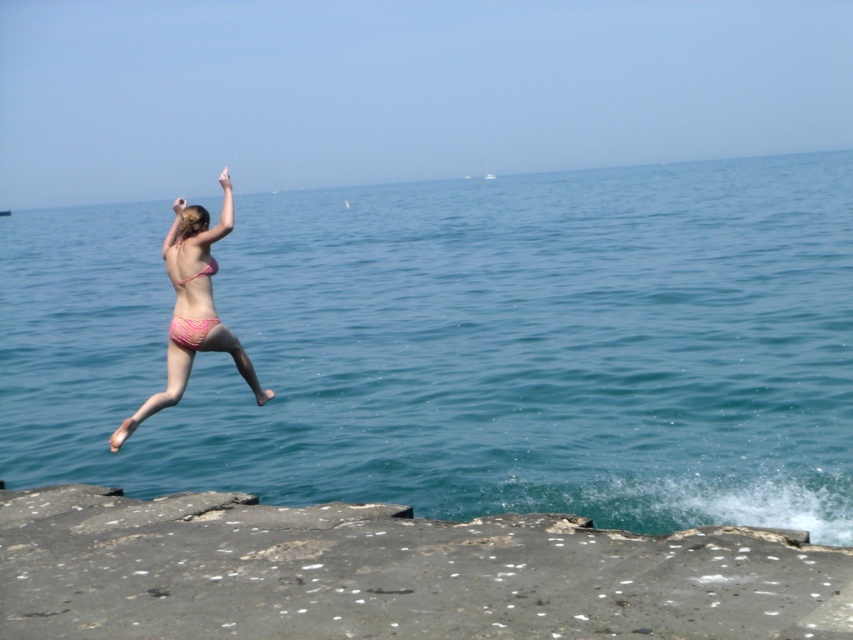
Question: Can you confirm if pink fabric bikini at left is positioned above pink matte bikini top at center?

Choices:
 (A) no
 (B) yes

Answer: (A)

Question: Which object appears farthest from the camera in this image?

Choices:
 (A) pink fabric bikini at left
 (B) pink bikini at center

Answer: (A)

Question: Estimate the real-world distances between objects in this image. Which object is closer to the gray concrete cliff at lower left?

Choices:
 (A) pink matte bikini top at center
 (B) pink fabric bikini at left

Answer: (B)

Question: From the image, what is the correct spatial relationship of pink bikini at center in relation to pink matte bikini top at center?

Choices:
 (A) left
 (B) right

Answer: (A)

Question: Can you confirm if gray concrete cliff at lower left is positioned to the right of pink fabric bikini at left?

Choices:
 (A) yes
 (B) no

Answer: (A)

Question: Among these objects, which one is farthest from the camera?

Choices:
 (A) pink fabric bikini at left
 (B) blue water at center
 (C) pink bikini at center

Answer: (A)